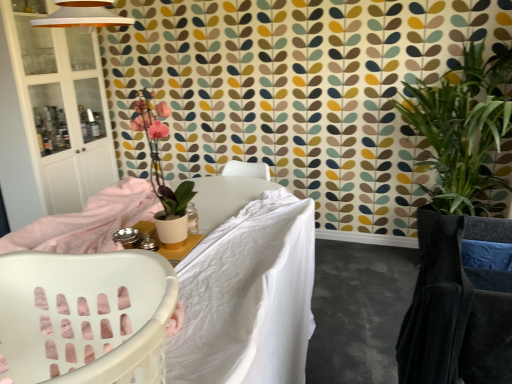
Where is `green leafy plant at right, which appears as the first houseplant when viewed from the right`? The image size is (512, 384). green leafy plant at right, which appears as the first houseplant when viewed from the right is located at coordinates point(461,231).

Describe the element at coordinates (166, 247) in the screenshot. I see `matte white table at center` at that location.

The height and width of the screenshot is (384, 512). What do you see at coordinates (34, 120) in the screenshot?
I see `white glass cabinet at left` at bounding box center [34, 120].

Identify the location of white glass cabinet at left. The width and height of the screenshot is (512, 384). (34, 120).

Describe the element at coordinates (248, 295) in the screenshot. This screenshot has height=384, width=512. I see `white fabric bed at center` at that location.

The height and width of the screenshot is (384, 512). What do you see at coordinates (248, 297) in the screenshot?
I see `white soft fabric at center` at bounding box center [248, 297].

The width and height of the screenshot is (512, 384). Describe the element at coordinates (84, 317) in the screenshot. I see `white plastic laundry basket at left` at that location.

Locate an element on the screen. green leafy plant at right, placed as the 1th houseplant when sorted from back to front is located at coordinates (461, 231).

Is velvet dark grey rocking chair at right shorter than matte white pot at upper left, marked as the 1th houseplant in a left-to-right arrangement?

In fact, velvet dark grey rocking chair at right may be taller than matte white pot at upper left, marked as the 1th houseplant in a left-to-right arrangement.

Is velvet dark grey rocking chair at right further to the viewer compared to matte white pot at upper left, marked as the 1th houseplant in a left-to-right arrangement?

No, it is not.

From a real-world perspective, is velvet dark grey rocking chair at right positioned above or below matte white pot at upper left, which ranks as the first houseplant in front-to-back order?

In terms of real-world spatial position, velvet dark grey rocking chair at right is below matte white pot at upper left, which ranks as the first houseplant in front-to-back order.

Considering the relative sizes of velvet dark grey rocking chair at right and matte white pot at upper left, marked as the 1th houseplant in a left-to-right arrangement, in the image provided, is velvet dark grey rocking chair at right thinner than matte white pot at upper left, marked as the 1th houseplant in a left-to-right arrangement,?

Incorrect, the width of velvet dark grey rocking chair at right is not less than that of matte white pot at upper left, marked as the 1th houseplant in a left-to-right arrangement.

From the image's perspective, which is below, white soft fabric at center or matte white pot at upper left, arranged as the second houseplant when viewed from the back?

white soft fabric at center appears lower in the image.

How many degrees apart are the facing directions of white soft fabric at center and matte white pot at upper left, which ranks as the first houseplant in front-to-back order?

0.698 degrees.

Which object is more forward, white soft fabric at center or matte white pot at upper left, which ranks as the first houseplant in front-to-back order?

matte white pot at upper left, which ranks as the first houseplant in front-to-back order, is closer to the camera.

How much distance is there between white soft fabric at center and matte white pot at upper left, which is the second houseplant in right-to-left order?

A distance of 2.10 meters exists between white soft fabric at center and matte white pot at upper left, which is the second houseplant in right-to-left order.

Consider the image. Could you tell me if matte white pot at upper left, marked as the 1th houseplant in a left-to-right arrangement, is facing velvet dark grey rocking chair at right?

No, matte white pot at upper left, marked as the 1th houseplant in a left-to-right arrangement, does not turn towards velvet dark grey rocking chair at right.

Which is closer, [174,206] or [422,243]?

Positioned in front is point [422,243].

Is matte white pot at upper left, which ranks as the first houseplant in front-to-back order, wider than velvet dark grey rocking chair at right?

In fact, matte white pot at upper left, which ranks as the first houseplant in front-to-back order, might be narrower than velvet dark grey rocking chair at right.

Is white plastic laundry basket at left positioned in front of matte white table at center?

That is True.

Consider the image. Is white plastic laundry basket at left not inside matte white table at center?

Yes, white plastic laundry basket at left is outside of matte white table at center.

Does point (70, 320) come closer to viewer compared to point (173, 250)?

That is True.

Does white plastic laundry basket at left touch matte white table at center?

white plastic laundry basket at left is not next to matte white table at center, and they're not touching.

Locate an element on the screen. The width and height of the screenshot is (512, 384). rocking chair in front of the white glass cabinet at left is located at coordinates (457, 307).

Considering the relative sizes of white glass cabinet at left and velvet dark grey rocking chair at right in the image provided, is white glass cabinet at left wider than velvet dark grey rocking chair at right?

Yes, white glass cabinet at left is wider than velvet dark grey rocking chair at right.

Which of these two, white glass cabinet at left or velvet dark grey rocking chair at right, is smaller?

Smaller between the two is velvet dark grey rocking chair at right.

Which object is positioned more to the left, white glass cabinet at left or velvet dark grey rocking chair at right?

white glass cabinet at left.

In the image, is white fabric bed at center on the left side or the right side of velvet dark grey rocking chair at right?

Clearly, white fabric bed at center is on the left of velvet dark grey rocking chair at right in the image.

Considering the sizes of objects white fabric bed at center and velvet dark grey rocking chair at right in the image provided, who is smaller, white fabric bed at center or velvet dark grey rocking chair at right?

velvet dark grey rocking chair at right is smaller.

Does white fabric bed at center have a greater width compared to velvet dark grey rocking chair at right?

Correct, the width of white fabric bed at center exceeds that of velvet dark grey rocking chair at right.

Between white fabric bed at center and velvet dark grey rocking chair at right, which one has less height?

Standing shorter between the two is white fabric bed at center.

Would you consider white plastic laundry basket at left to be distant from green leafy plant at right, placed as the 1th houseplant when sorted from back to front?

Yes.

Can we say white plastic laundry basket at left lies outside green leafy plant at right, placed as the 1th houseplant when sorted from back to front?

white plastic laundry basket at left lies outside green leafy plant at right, placed as the 1th houseplant when sorted from back to front,'s area.

Is white plastic laundry basket at left wider than green leafy plant at right, arranged as the 2th houseplant when viewed from the left?

In fact, white plastic laundry basket at left might be narrower than green leafy plant at right, arranged as the 2th houseplant when viewed from the left.

Considering the sizes of objects white plastic laundry basket at left and green leafy plant at right, which appears as the first houseplant when viewed from the right, in the image provided, who is smaller, white plastic laundry basket at left or green leafy plant at right, which appears as the first houseplant when viewed from the right,?

white plastic laundry basket at left.

The image size is (512, 384). I want to click on rocking chair located in front of the matte white pot at upper left, which ranks as the first houseplant in front-to-back order, so click(457, 307).

You are a GUI agent. You are given a task and a screenshot of the screen. Output one action in this format:
    pyautogui.click(x=<x>, y=<y>)
    Task: Click on the blanket below the matte white pot at upper left, which ranks as the first houseplant in front-to-back order (from the image's perspective)
    
    Given the screenshot: What is the action you would take?
    pyautogui.click(x=248, y=297)

When comparing their distances from matte white pot at upper left, arranged as the second houseplant when viewed from the back, does matte white table at center or white fabric bed at center seem further?

white fabric bed at center lies further to matte white pot at upper left, arranged as the second houseplant when viewed from the back, than the other object.

Which object lies nearer to the anchor point white soft fabric at center, matte white pot at upper left, which ranks as the first houseplant in front-to-back order, or green leafy plant at right, arranged as the 2th houseplant when viewed from the left?

The object closer to white soft fabric at center is green leafy plant at right, arranged as the 2th houseplant when viewed from the left.

Looking at the image, which one is located further to green leafy plant at right, which appears as the second houseplant when viewed from the front, matte white pot at upper left, which is the second houseplant in right-to-left order, or white glass cabinet at left?

The object further to green leafy plant at right, which appears as the second houseplant when viewed from the front, is white glass cabinet at left.

Which object lies further to the anchor point velvet dark grey rocking chair at right, matte white pot at upper left, which is the second houseplant in right-to-left order, or white fabric bed at center?

matte white pot at upper left, which is the second houseplant in right-to-left order, is further to velvet dark grey rocking chair at right.

From the image, which object appears to be farther from green leafy plant at right, which appears as the first houseplant when viewed from the right, white glass cabinet at left or matte white pot at upper left, marked as the 1th houseplant in a left-to-right arrangement?

white glass cabinet at left lies further to green leafy plant at right, which appears as the first houseplant when viewed from the right, than the other object.

Considering their positions, is white glass cabinet at left positioned closer to white soft fabric at center than matte white table at center?

matte white table at center is closer to white soft fabric at center.

Looking at this image, based on their spatial positions, is white fabric bed at center or white plastic laundry basket at left closer to white glass cabinet at left?

The object closer to white glass cabinet at left is white fabric bed at center.

Looking at the image, which one is located closer to matte white table at center, velvet dark grey rocking chair at right or matte white pot at upper left, which is the second houseplant in right-to-left order?

velvet dark grey rocking chair at right.

Locate an element on the screen. houseplant between white plastic laundry basket at left and green leafy plant at right, arranged as the 2th houseplant when viewed from the left, in the horizontal direction is located at coordinates (163, 175).

Where is `bed located between white glass cabinet at left and green leafy plant at right, which appears as the first houseplant when viewed from the right, in the left-right direction`? The height and width of the screenshot is (384, 512). bed located between white glass cabinet at left and green leafy plant at right, which appears as the first houseplant when viewed from the right, in the left-right direction is located at coordinates (248, 295).

Identify the location of table between white fabric bed at center and white glass cabinet at left in the front-back direction. (166, 247).

Locate an element on the screen. The image size is (512, 384). blanket situated between matte white table at center and velvet dark grey rocking chair at right from left to right is located at coordinates (248, 297).